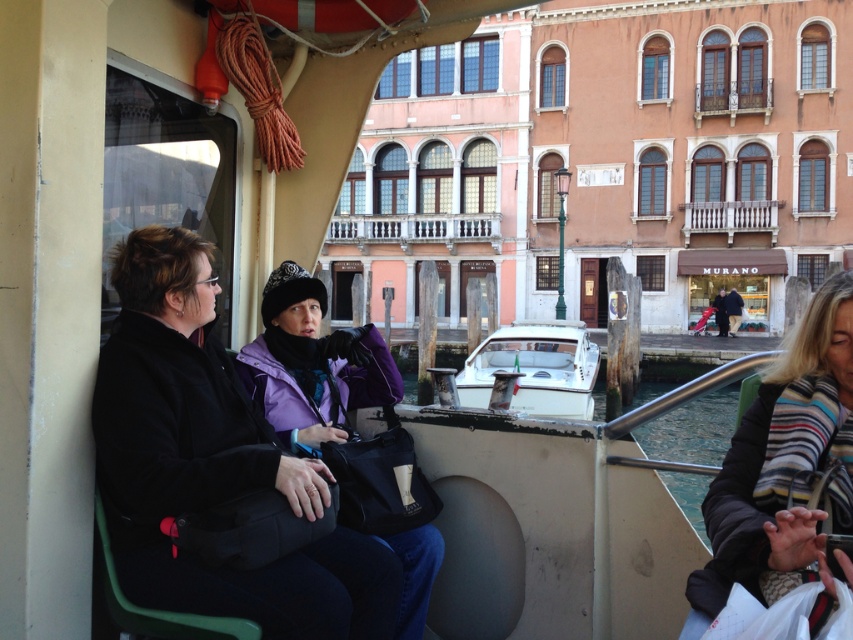
You are a passenger on a boat ride in Venice. You notice the black fabric coach at center and the striped wool scarf at lower right. Which object is positioned higher in the image?

The striped wool scarf at lower right is positioned higher than the black fabric coach at center.

You are a tourist in Venice and you see the black fabric coach at center in the boat. Where exactly is it located in terms of coordinates?

The black fabric coach at center is located at coordinates point (212, 461).

You are a passenger on a boat ride in Venice and need to reach the striped wool scarf at lower right from the purple fleece jacket at center. Can you walk directly to it without moving past the beige wall?

The striped wool scarf at lower right is 12.54 feet away from the purple fleece jacket at center, so walking directly to it would require moving past the beige wall since the distance is quite large and the beige wall is part of the boat interior.